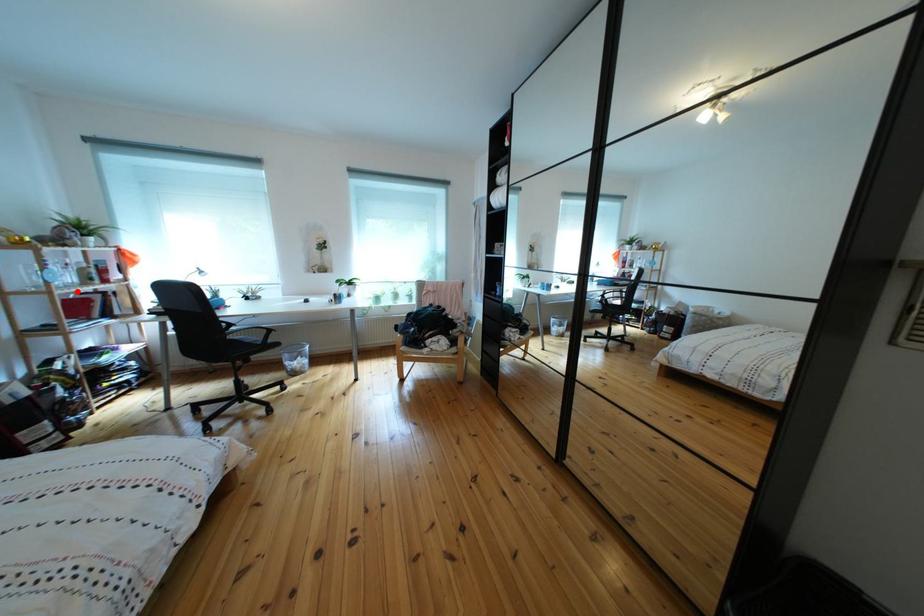
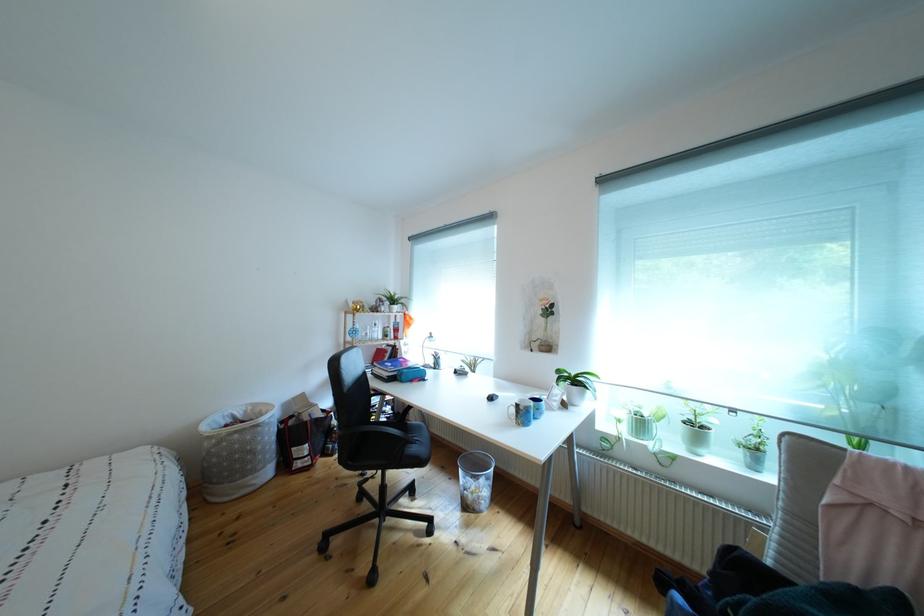
Question: I am providing you with two images of the same scene from different viewpoints. A red point is marked on the first image. Can you still see the location of the red point in image 2?

Choices:
 (A) Yes
 (B) No

Answer: (A)